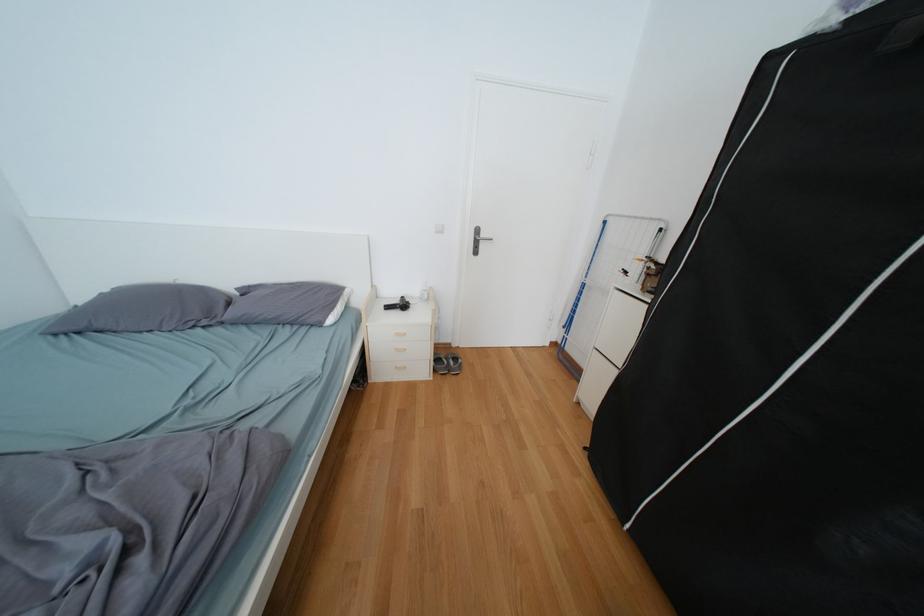
Where would you press the white wall switch? Please return your answer as a coordinate pair (x, y).

(439, 228)